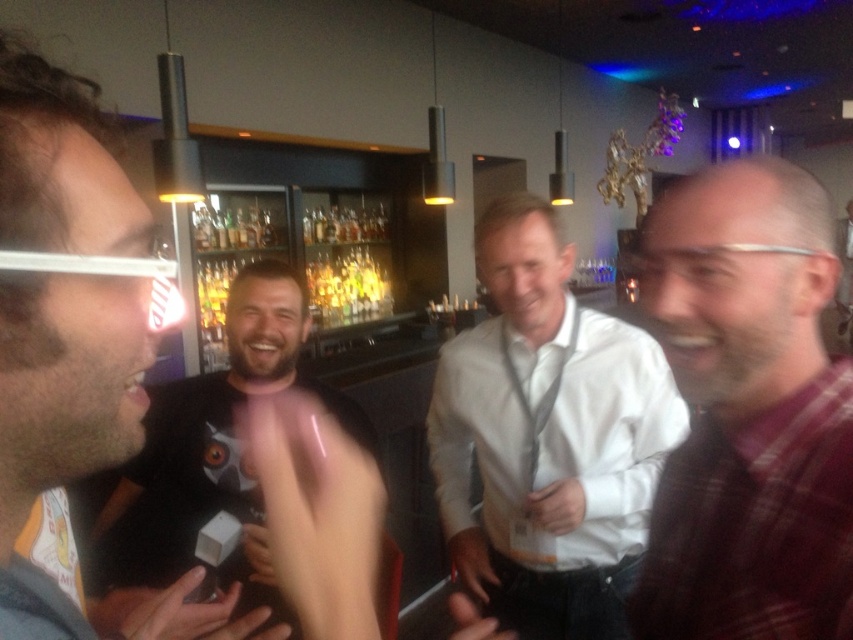
Is plaid fabric shirt at right bigger than white shirt at center?

Incorrect, plaid fabric shirt at right is not larger than white shirt at center.

Does point (740, 284) come behind point (488, 452)?

No, (740, 284) is in front of (488, 452).

Where is `plaid fabric shirt at right`? The image size is (853, 640). plaid fabric shirt at right is located at coordinates (747, 412).

Who is more forward, (431, 452) or (62, 148)?

Point (62, 148) is in front.

Does white shirt at center have a greater width compared to matte black shirt at left?

Yes, white shirt at center is wider than matte black shirt at left.

Between point (531, 291) and point (0, 524), which one is positioned in front?

Point (0, 524)

The image size is (853, 640). In order to click on white shirt at center in this screenshot , I will do `click(548, 436)`.

Which of these two, plaid fabric shirt at right or black matte t-shirt at center, stands shorter?

Standing shorter between the two is plaid fabric shirt at right.

Can you confirm if plaid fabric shirt at right is positioned below black matte t-shirt at center?

No, plaid fabric shirt at right is not below black matte t-shirt at center.

This screenshot has width=853, height=640. Find the location of `plaid fabric shirt at right`. plaid fabric shirt at right is located at coordinates (747, 412).

The height and width of the screenshot is (640, 853). Identify the location of plaid fabric shirt at right. 747,412.